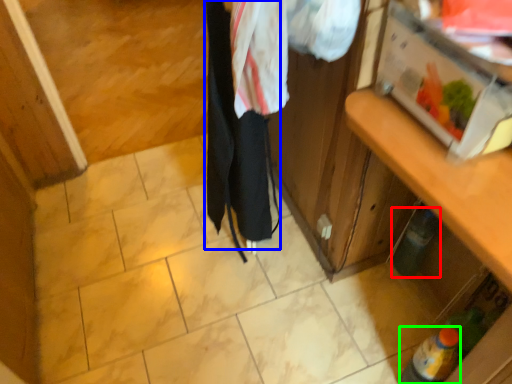
Question: Considering the real-world distances, which object is farthest from bottle (highlighted by a red box)? clothing (highlighted by a blue box) or bottle (highlighted by a green box)?

Choices:
 (A) clothing
 (B) bottle

Answer: (A)